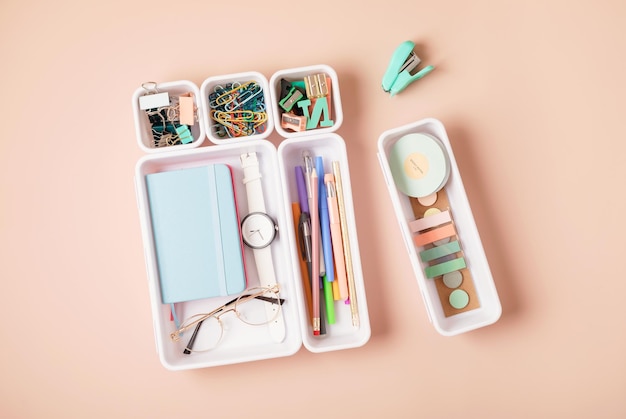
Where is `pens, pencils`? The image size is (626, 419). pens, pencils is located at coordinates pos(342,260), pos(327,238), pos(317,219), pos(299,184), pos(299,236), pos(335,315).